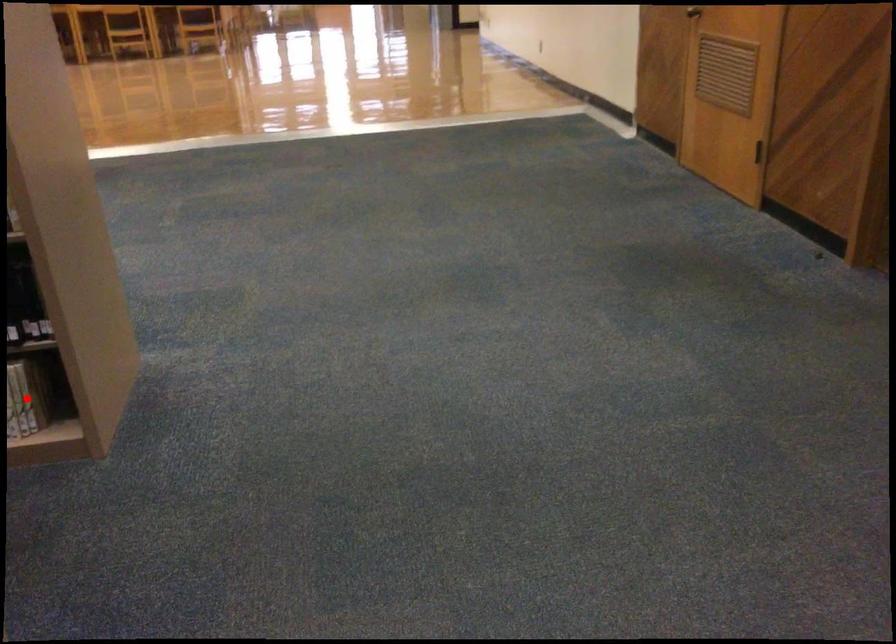
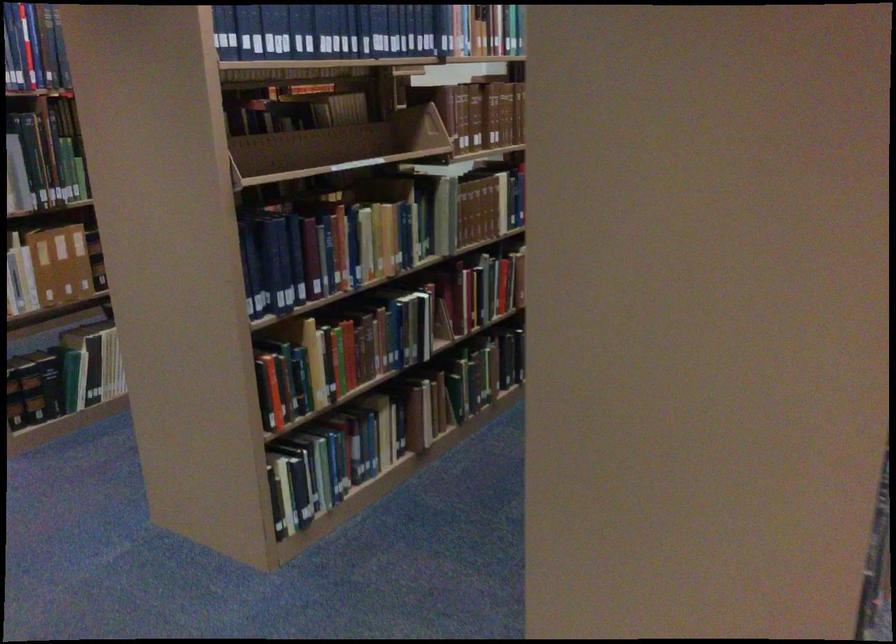
Question: I am providing you with two images of the same scene from different viewpoints. A red point is marked on the first image. At the location where the point appears in image 1, is it still visible in image 2?

Choices:
 (A) Yes
 (B) No

Answer: (B)